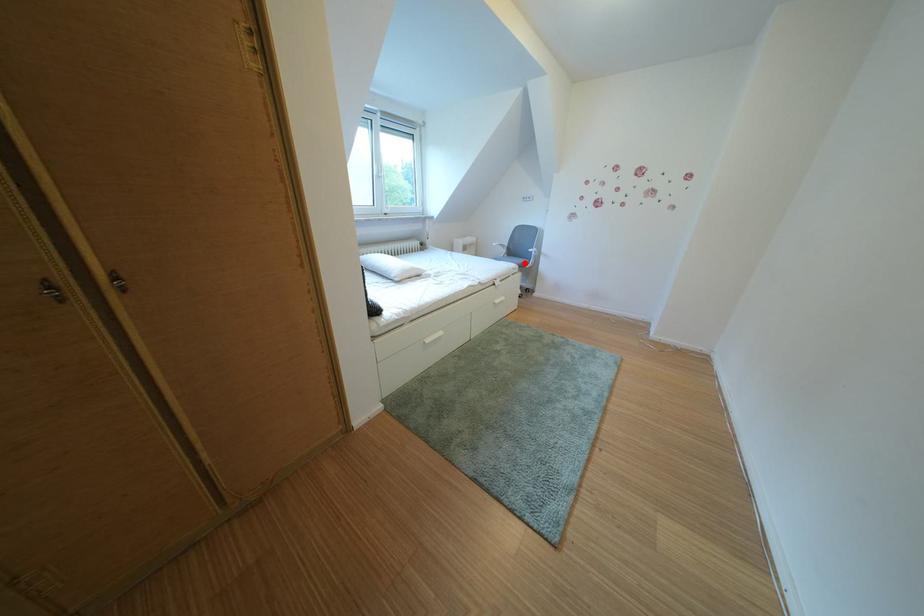
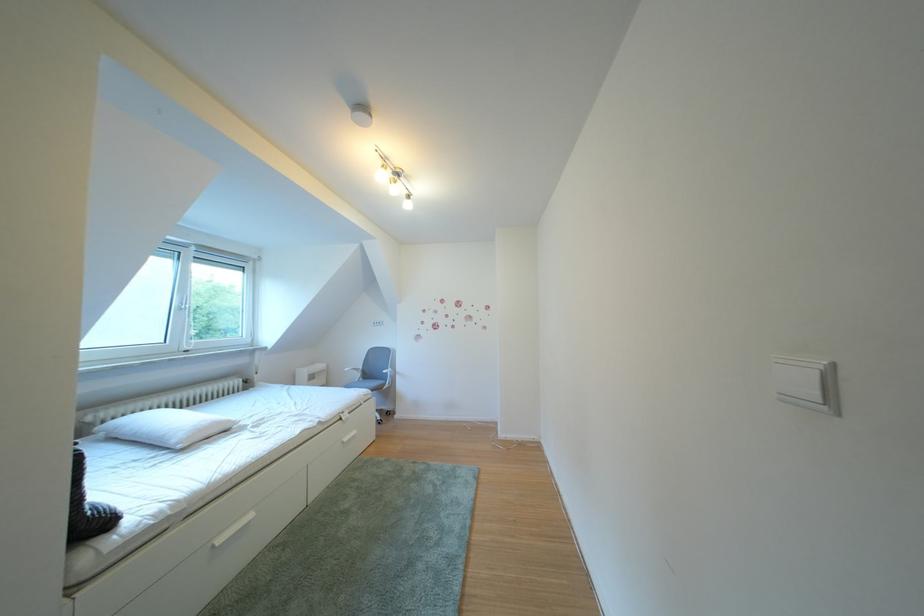
Question: I am providing you with two images of the same scene from different viewpoints. A red point is shown in image1. For the corresponding object point in image2, is it positioned nearer or farther from the camera?

Choices:
 (A) Nearer
 (B) Farther

Answer: (B)